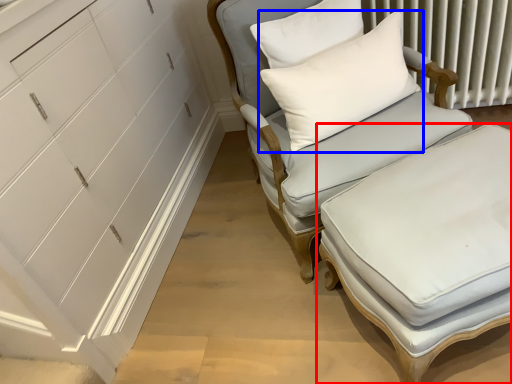
Question: Which object appears farthest to the camera in this image, table (highlighted by a red box) or pillow (highlighted by a blue box)?

Choices:
 (A) table
 (B) pillow

Answer: (B)